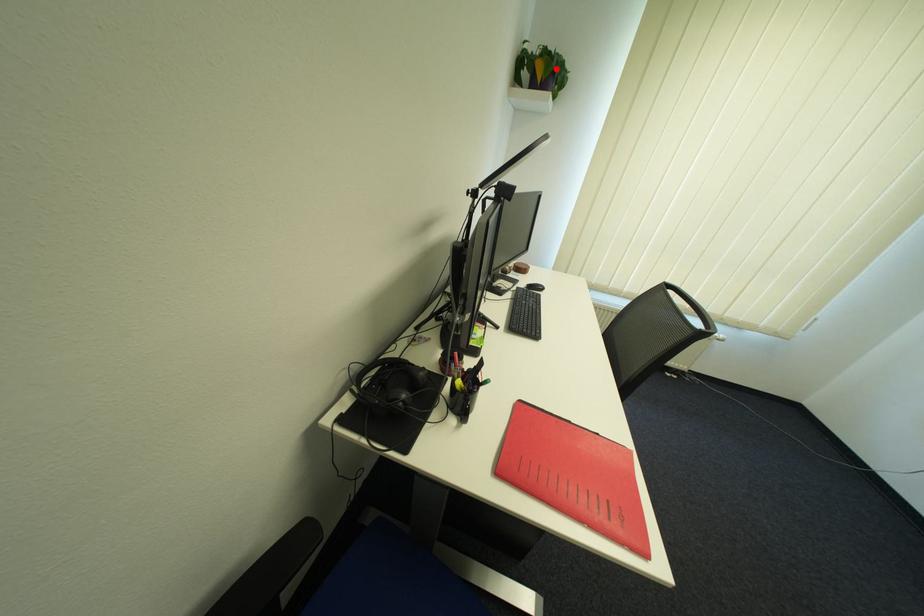
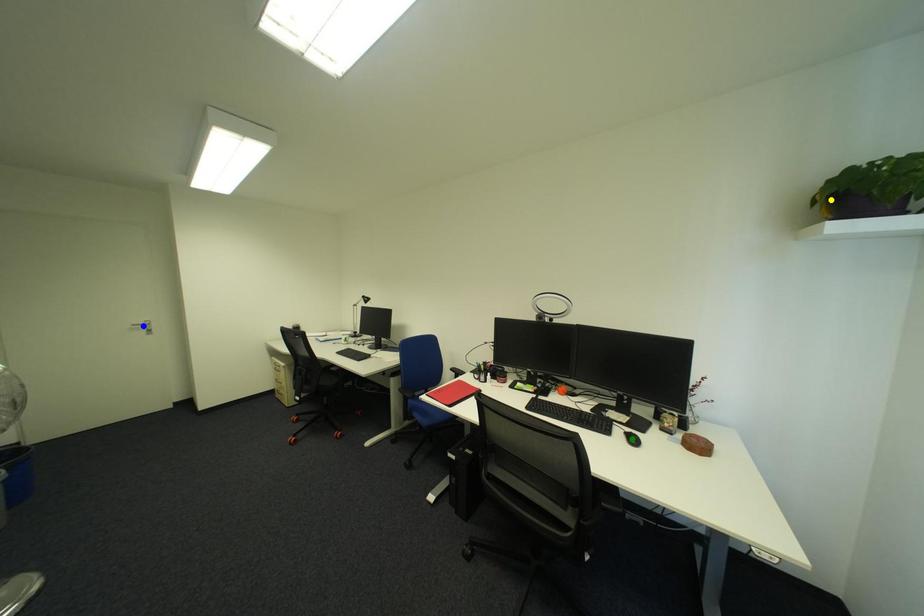
Question: I am providing you with two images of the same scene from different viewpoints. A red point is marked on the first image. You are given multiple points on the second image. Which mark in image 2 goes with the point in image 1?

Choices:
 (A) yellow point
 (B) green point
 (C) blue point

Answer: (A)